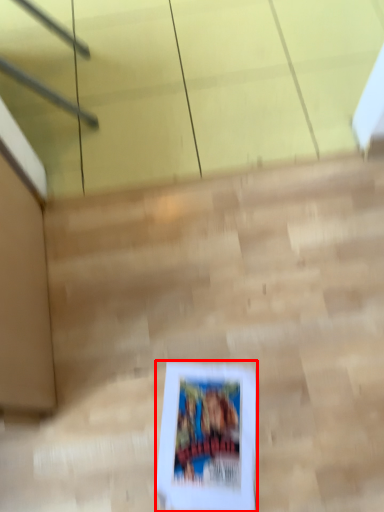
Question: From the image's perspective, where is picture frame (annotated by the red box) located relative to stairwell?

Choices:
 (A) above
 (B) below

Answer: (B)